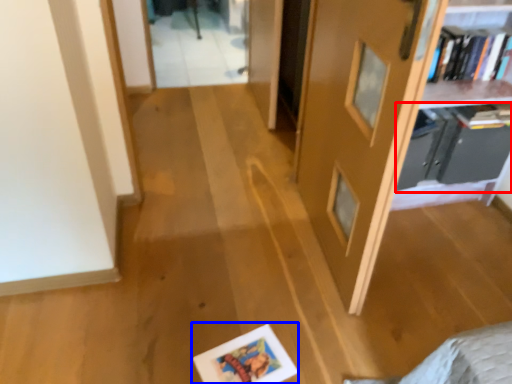
Question: Among these objects, which one is farthest to the camera, shelf (highlighted by a red box) or picture frame (highlighted by a blue box)?

Choices:
 (A) shelf
 (B) picture frame

Answer: (A)